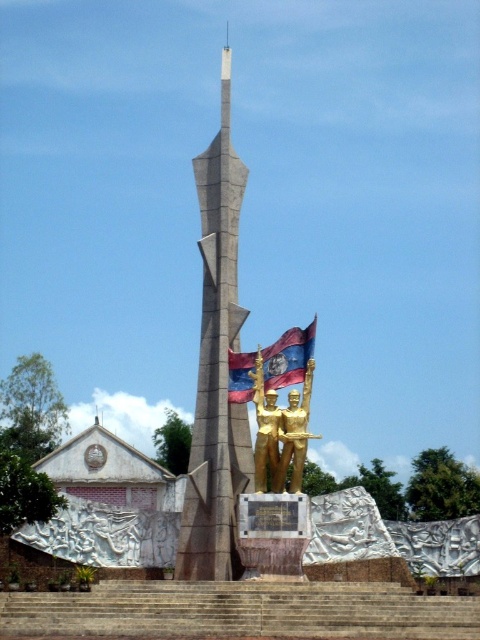
You are standing at the base of the monument and want to climb up to the top. Which object, the brown stone stairs at center or the gray concrete tower at center, should you use to reach the highest point?

The gray concrete tower at center is taller than the brown stone stairs at center, so you should use the gray concrete tower at center to reach the highest point.

You are standing at the entrance of the monument complex and want to reach the monument. The brown stone stairs at center are the only path. Given that the stairs are 98.09 meters away from you, can you estimate how long it would take to walk there at a normal pace?

The brown stone stairs at center are 98.09 meters away. At a normal walking pace of approximately 1.4 meters per second, it would take roughly 70 seconds to reach the stairs. Since the stairs are the only path to the monument, you can proceed towards them.

You are standing in front of the monument and want to approach the gold metallic statue at center. Which direction should you move relative to the brown stone stairs at center?

You should move to the right relative to the brown stone stairs at center because the gold metallic statue at center is to the right of the stairs.